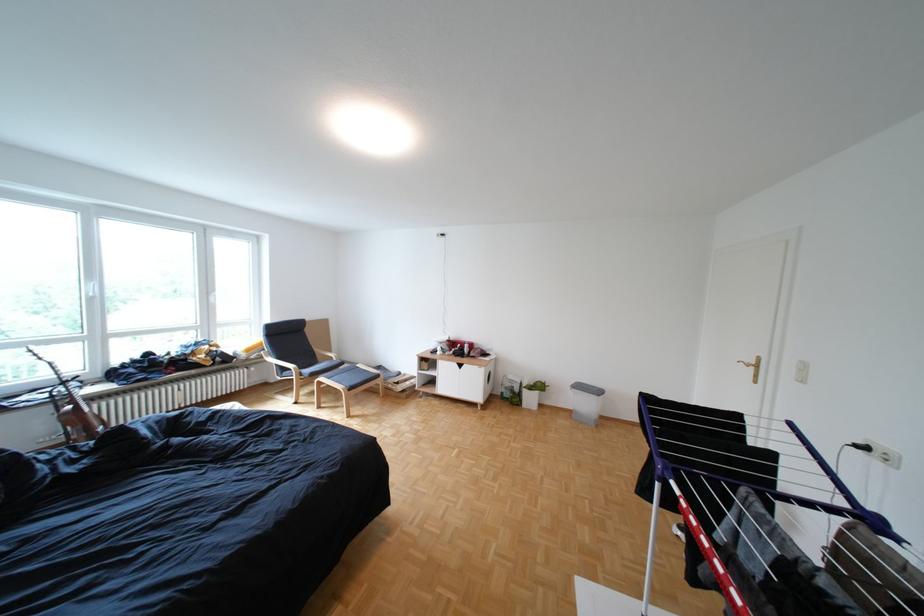
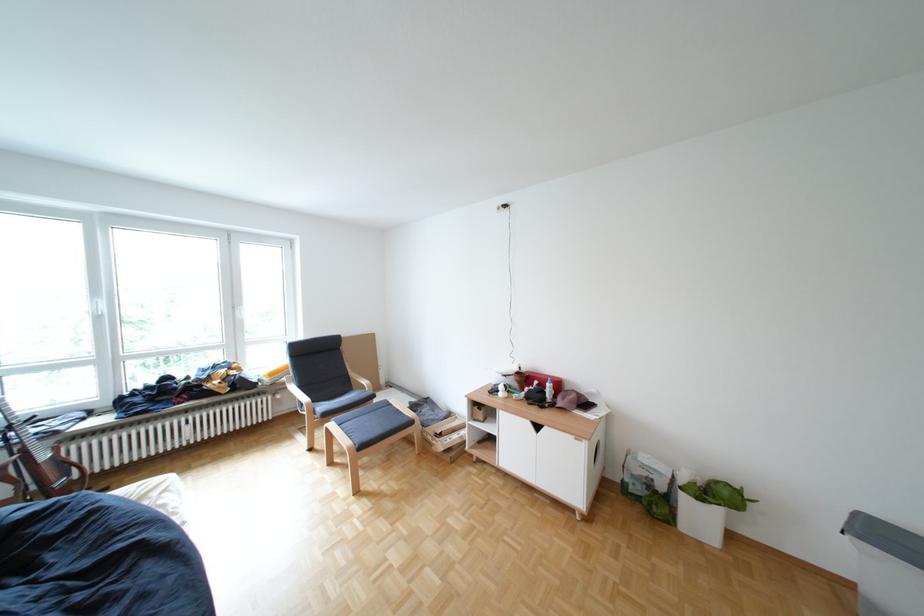
Find the pixel in the second image that matches point 337,379 in the first image.

(346, 424)